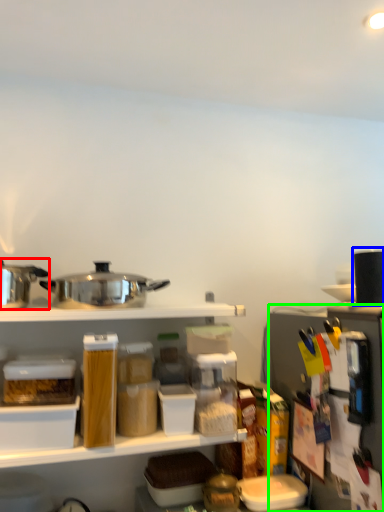
Question: Considering the real-world distances, which object is closest to appliance (highlighted by a red box)? appliance (highlighted by a blue box) or appliance (highlighted by a green box).

Choices:
 (A) appliance
 (B) appliance

Answer: (B)